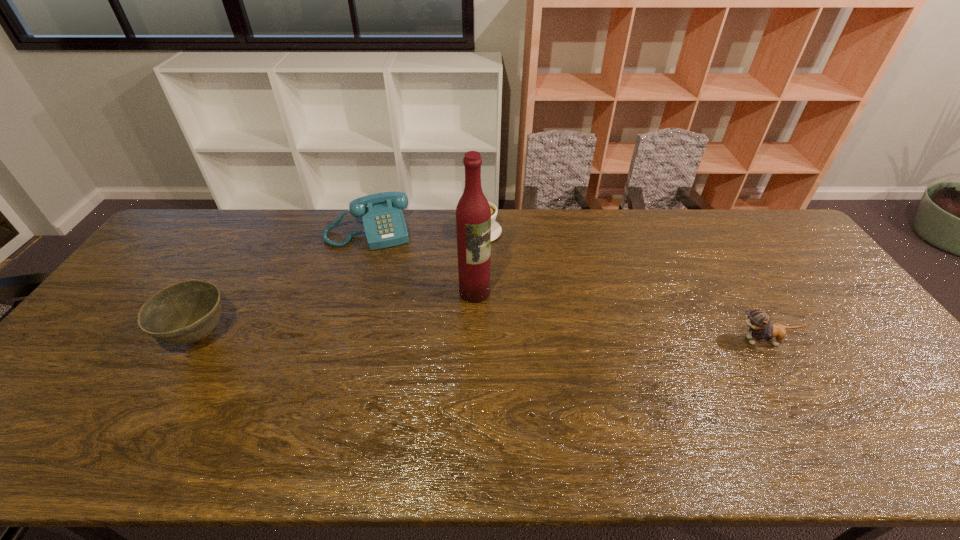
Where is `telephone located in the far edge section of the desktop`? telephone located in the far edge section of the desktop is located at coordinates (384, 225).

Locate an element on the screen. vacant region at the far edge of the desktop is located at coordinates (526, 240).

The height and width of the screenshot is (540, 960). Identify the location of free space at the left edge. (97, 325).

Identify the location of blank space at the right edge of the desktop. This screenshot has width=960, height=540. (806, 312).

Locate an element on the screen. The width and height of the screenshot is (960, 540). vacant region at the far left corner of the desktop is located at coordinates (181, 225).

The width and height of the screenshot is (960, 540). Identify the location of free space at the far right corner of the desktop. (773, 244).

This screenshot has width=960, height=540. I want to click on vacant area between the tallest object and the kitten, so click(x=619, y=316).

I want to click on free spot between the second object from left to right and the kitten, so click(566, 286).

Identify the location of unoccupied area between the kitten and the cappuccino. Image resolution: width=960 pixels, height=540 pixels. (622, 287).

This screenshot has width=960, height=540. I want to click on free space between the leftmost object and the cappuccino, so (340, 284).